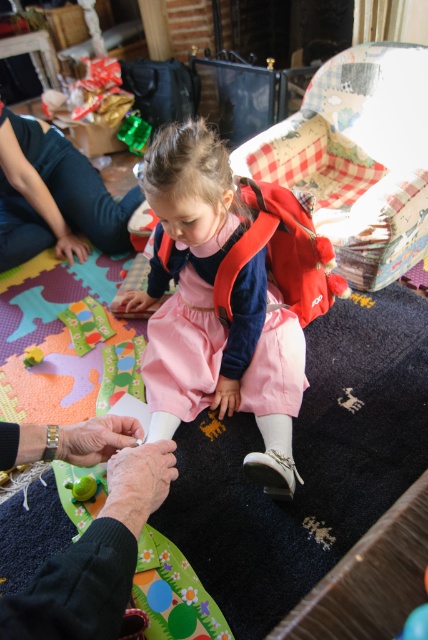
Between pink satin dress at center and dark green fabric at upper left, which one has less height?

dark green fabric at upper left is shorter.

Can you confirm if pink satin dress at center is positioned below dark green fabric at upper left?

Correct, pink satin dress at center is located below dark green fabric at upper left.

The width and height of the screenshot is (428, 640). What do you see at coordinates (214, 308) in the screenshot?
I see `pink satin dress at center` at bounding box center [214, 308].

Identify the location of pink satin dress at center. This screenshot has height=640, width=428. (214, 308).

Can you confirm if pink satin dress at center is positioned to the left of green matte toy at lower left?

In fact, pink satin dress at center is to the right of green matte toy at lower left.

Is pink satin dress at center shorter than green matte toy at lower left?

Incorrect, pink satin dress at center's height does not fall short of green matte toy at lower left's.

The image size is (428, 640). Describe the element at coordinates (214, 308) in the screenshot. I see `pink satin dress at center` at that location.

Locate an element on the screen. pink satin dress at center is located at coordinates (214, 308).

Can you confirm if dark green fabric at upper left is positioned to the right of green matte toy at lower left?

Incorrect, dark green fabric at upper left is not on the right side of green matte toy at lower left.

Which is below, dark green fabric at upper left or green matte toy at lower left?

Positioned lower is green matte toy at lower left.

Is point (17, 204) positioned before point (79, 488)?

No, it is behind (79, 488).

Identify the location of dark green fabric at upper left. (56, 196).